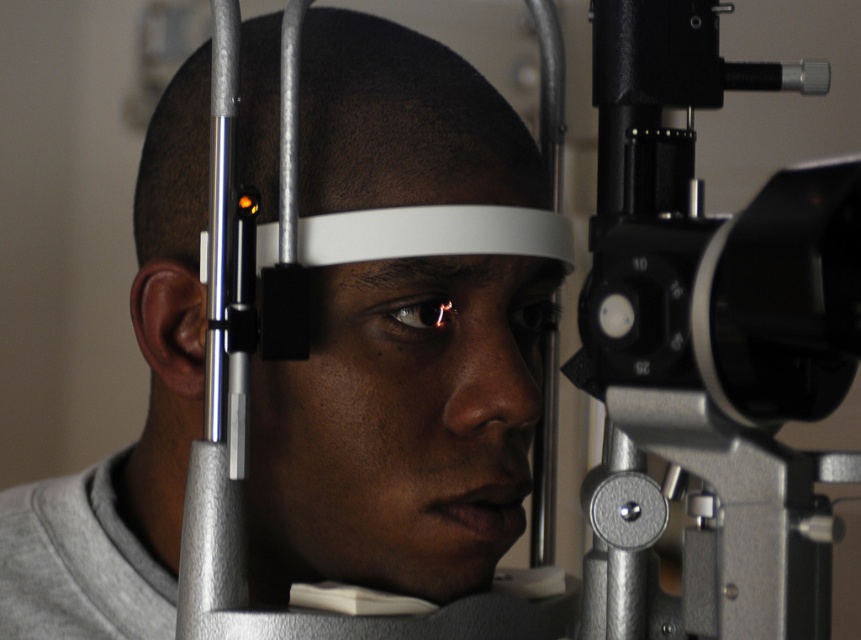
Between matte white forehead at center and shiny black eye at center, which one has less height?

shiny black eye at center

Who is positioned more to the right, matte white forehead at center or shiny black eye at center?

shiny black eye at center

Is point (389, 44) farther from camera compared to point (417, 308)?

Yes, point (389, 44) is farther from viewer.

Where is `matte white forehead at center`? The height and width of the screenshot is (640, 861). matte white forehead at center is located at coordinates (407, 145).

Does point (310, 49) come in front of point (392, 321)?

No, (310, 49) is behind (392, 321).

Is point (386, 378) positioned after point (437, 317)?

No.

The image size is (861, 640). I want to click on matte gray headband at center, so [406, 339].

How distant is shiny black eye at center from matte black eye at center?

3.70 inches

Who is lower down, shiny black eye at center or matte black eye at center?

matte black eye at center is lower down.

This screenshot has width=861, height=640. What are the coordinates of `shiny black eye at center` in the screenshot? It's located at (418, 316).